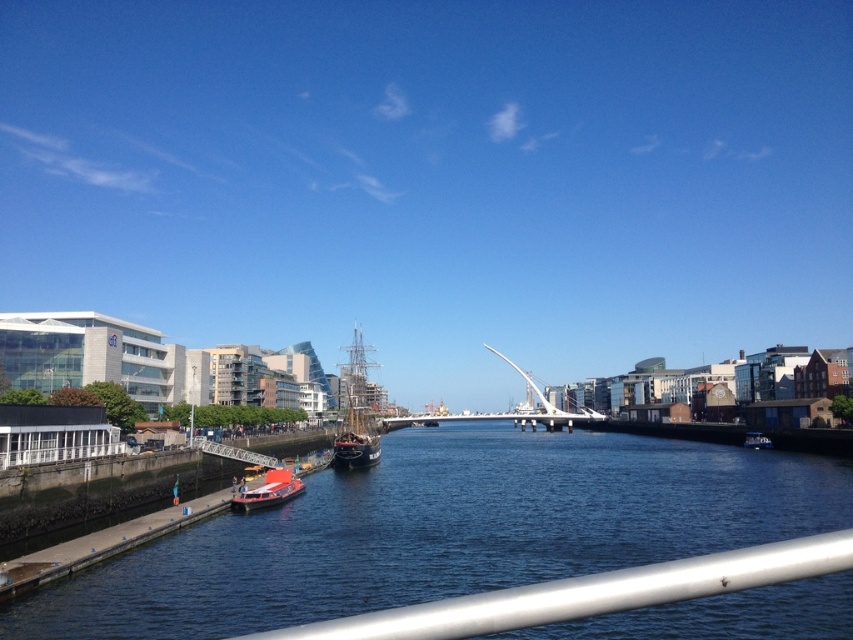
You are standing at the center of the white bridge and want to reach a point that is closer to you. Which point should you go to, point (415, 420) or point (271, 502)?

Point (415, 420) is closer to you because it is further to the viewer than point (271, 502).

You are standing at the point marked by coordinates point (x=445, y=531) and want to reach the modern building with large glass windows on the left bank of the river. Which direction should you move to get there?

The blue water at lower left is represented by point (x=445, y=531). To reach the modern building with large glass windows on the left bank of the river, you should move towards the left bank, which is the opposite direction of the right bank where the red brick structure is located.

You are a tourist standing at the riverside and want to take a photo of both the silver metallic railing at lower center and the red matte boat at lower left. Since you have a wide angle lens, will you be able to capture both objects in a single frame without moving your position?

The silver metallic railing at lower center is larger in size than the red matte boat at lower left, so it might block the view of the boat if they are positioned close to each other. However, since the railing is at lower center and the boat is at lower left, their positions might allow both to be in the frame depending on the lens angle. But since the question specifies a wide angle lens which has a broader field of view, it is likely possible to capture both in one frame without moving.